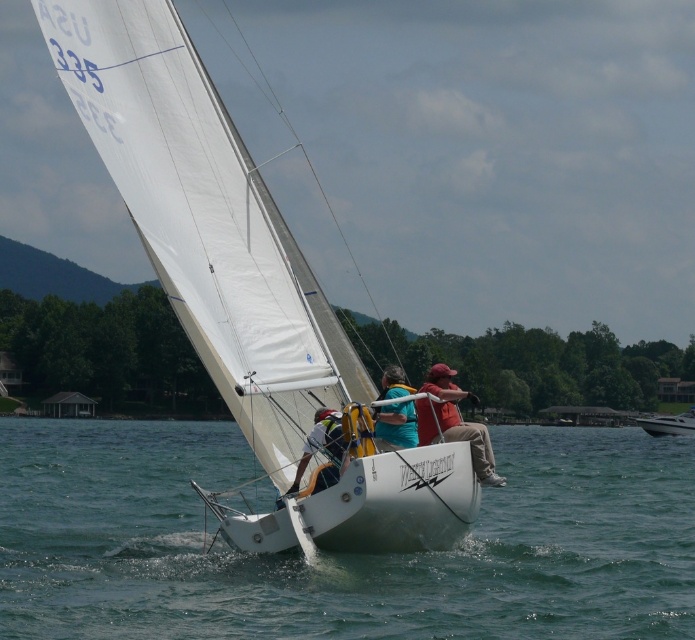
Consider the image. Who is positioned more to the left, matte blue shirt at center or blue fabric sail at center?

blue fabric sail at center

Is matte blue shirt at center behind blue fabric sail at center?

Yes, matte blue shirt at center is behind blue fabric sail at center.

Which is behind, point (386, 426) or point (336, 451)?

The point (386, 426) is behind.

Find the location of a particular element. This screenshot has height=640, width=695. matte blue shirt at center is located at coordinates (395, 426).

Who is shorter, blue fabric sail at center or white glossy boat at right?

blue fabric sail at center

Is point (322, 429) positioned before point (644, 420)?

Yes, point (322, 429) is in front of point (644, 420).

Who is more forward, (329, 467) or (682, 417)?

Point (329, 467) is more forward.

Identify the location of blue fabric sail at center. (322, 449).

Does white matte sailboat at center appear over blue fabric sail at center?

Yes, white matte sailboat at center is above blue fabric sail at center.

Between white matte sailboat at center and blue fabric sail at center, which one appears on the right side from the viewer's perspective?

blue fabric sail at center

I want to click on white matte sailboat at center, so click(x=204, y=220).